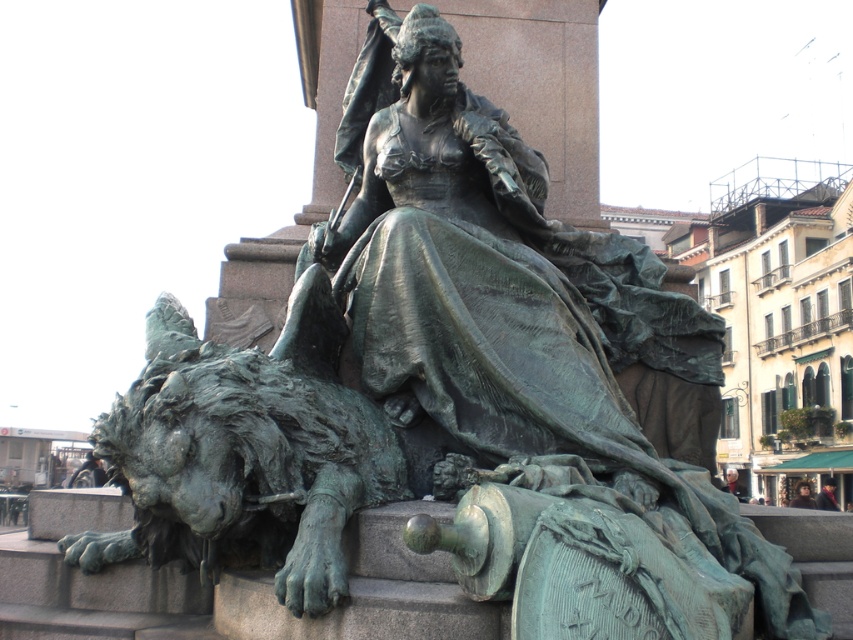
Question: Does green patina stone lion at lower left have a greater width compared to light brown hair at lower right?

Choices:
 (A) no
 (B) yes

Answer: (A)

Question: Does dark brown leather jacket at lower right have a greater width compared to smooth brown hair at lower right?

Choices:
 (A) no
 (B) yes

Answer: (B)

Question: Which point is farther to the camera?

Choices:
 (A) (824, 486)
 (B) (131, 548)
 (C) (735, 481)
 (D) (390, 304)

Answer: (C)

Question: Which of the following is the closest to the observer?

Choices:
 (A) light brown hair at lower right
 (B) bronze statue at center
 (C) dark brown leather jacket at lower right

Answer: (B)

Question: Does bronze statue at center have a lesser width compared to smooth brown hair at lower right?

Choices:
 (A) yes
 (B) no

Answer: (B)

Question: Which of the following is the closest to the observer?

Choices:
 (A) bronze statue at center
 (B) smooth brown hair at lower right
 (C) light brown hair at lower right
 (D) green patina stone lion at lower left

Answer: (D)